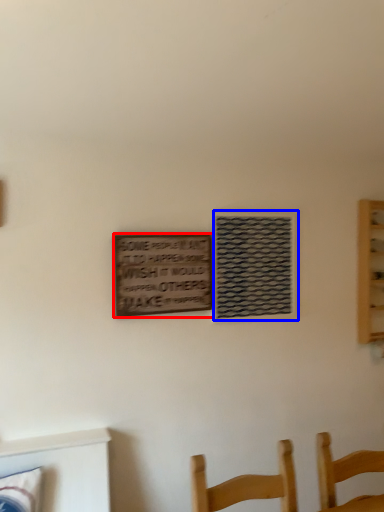
Question: Which object appears farthest to the camera in this image, plaque (highlighted by a red box) or window (highlighted by a blue box)?

Choices:
 (A) plaque
 (B) window

Answer: (B)